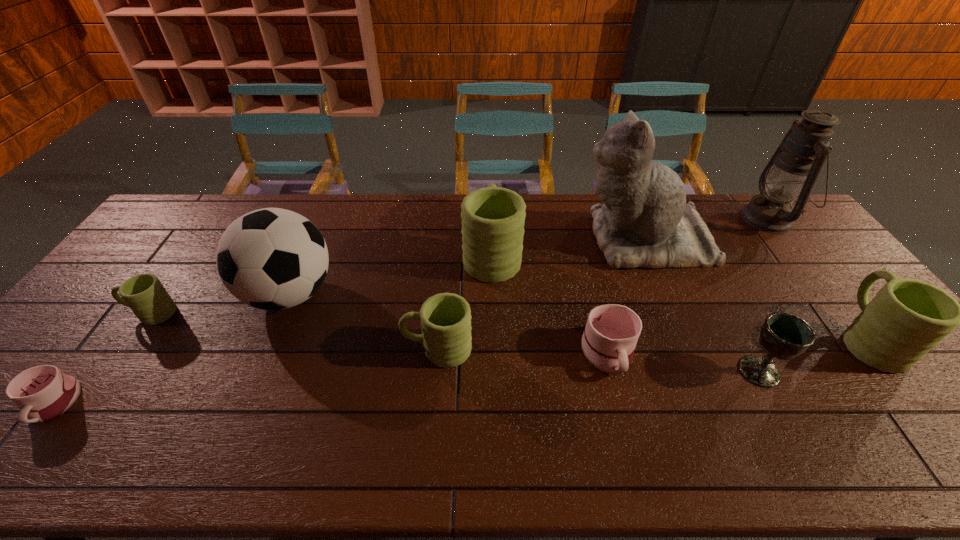
This screenshot has width=960, height=540. In order to click on blank space located on the side with the handle of the second mug from right to left in this screenshot , I will do `click(632, 447)`.

Identify the location of cat that is positioned at the far edge. (645, 222).

Identify the location of oil lamp that is at the far edge. Image resolution: width=960 pixels, height=540 pixels. (792, 171).

Find the location of a particular element. mug present at the far edge is located at coordinates (493, 218).

Image resolution: width=960 pixels, height=540 pixels. I want to click on object that is positioned at the near edge, so click(42, 393).

Where is `oil lamp that is positioned at the right edge`? The width and height of the screenshot is (960, 540). oil lamp that is positioned at the right edge is located at coordinates (792, 171).

Find the location of `mug at the right edge`. mug at the right edge is located at coordinates (907, 318).

Image resolution: width=960 pixels, height=540 pixels. Identify the location of object that is at the near left corner. (42, 393).

Identify the location of object that is at the far right corner. The width and height of the screenshot is (960, 540). (792, 171).

Identify the location of free space at the far edge of the desktop. The image size is (960, 540). (444, 212).